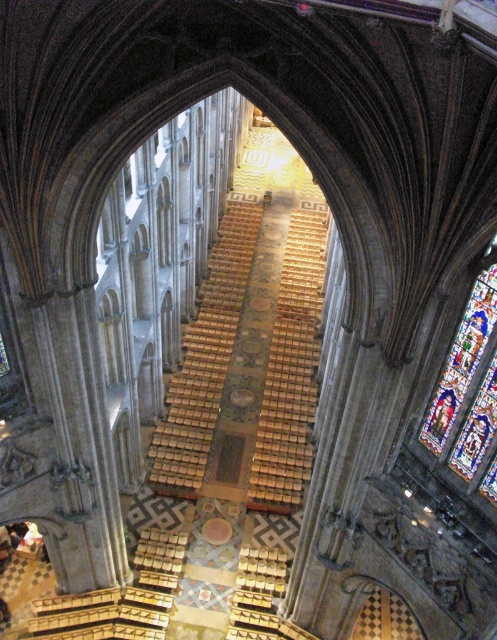
You are standing at the entrance of the cathedral and want to walk towards the stained glass at right. Which direction should you turn to avoid the wooden pews at center?

The wooden pews at center are to the left of the stained glass at right, so to avoid them, you should turn to the right towards the stained glass at right.

You are standing at the entrance of the cathedral and want to reach the wooden structure at the far end of the nave. Which direction should you walk relative to the wooden pews at center and the wooden at center?

The wooden pews at center are in front of the wooden at center, so you should walk towards the wooden at center, which is behind the wooden pews at center to reach the far end of the nave.